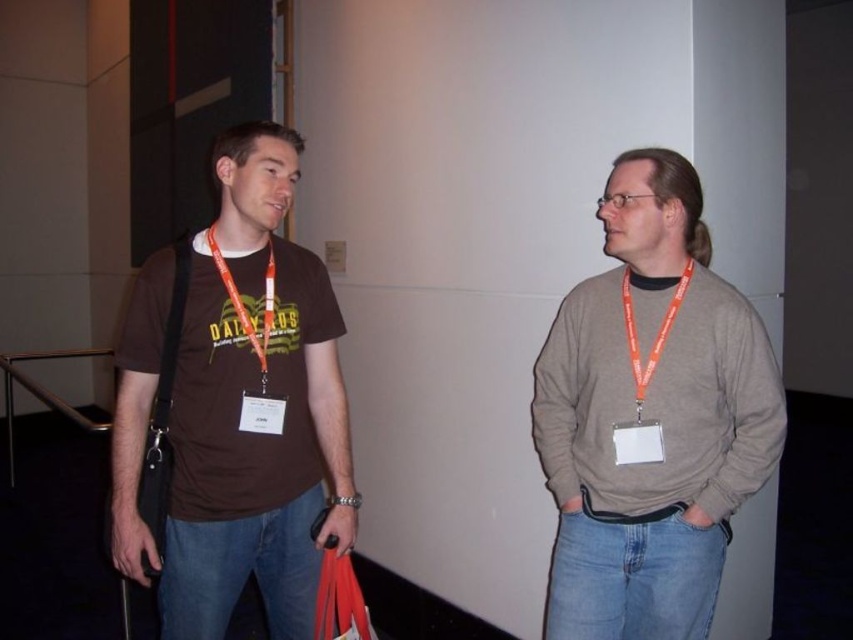
Question: Where is brown cotton t-shirt at left located in relation to matte orange lanyard at center in the image?

Choices:
 (A) left
 (B) right

Answer: (B)

Question: Is matte gray sweater at right wider than orange fabric lanyard at left?

Choices:
 (A) no
 (B) yes

Answer: (B)

Question: Estimate the real-world distances between objects in this image. Which object is farther from the orange fabric lanyard at left?

Choices:
 (A) brown cotton t-shirt at left
 (B) matte orange lanyard at center
 (C) matte gray sweater at right

Answer: (C)

Question: Which point is closer to the camera?

Choices:
 (A) (248, 248)
 (B) (659, 252)

Answer: (B)

Question: Which point is farther to the camera?

Choices:
 (A) orange lanyard at center
 (B) matte gray sweater at right
 (C) matte orange lanyard at center
 (D) orange fabric lanyard at left

Answer: (D)

Question: Observing the image, what is the correct spatial positioning of brown cotton t-shirt at left in reference to orange lanyard at center?

Choices:
 (A) below
 (B) above

Answer: (A)